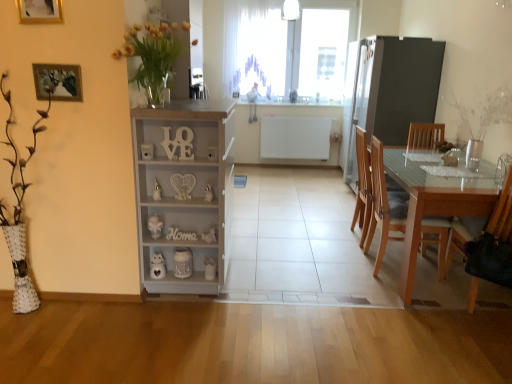
The height and width of the screenshot is (384, 512). In order to click on free location above transparent glass table at right (from a real-world perspective) in this screenshot , I will do `click(442, 163)`.